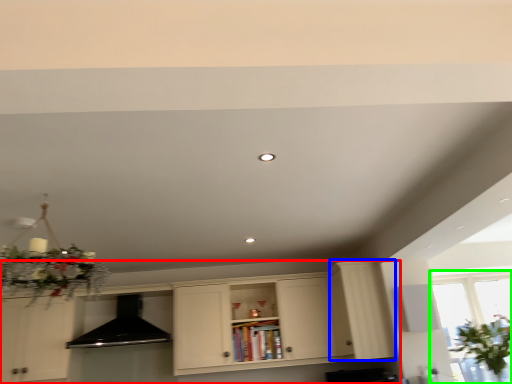
Question: Based on their relative distances, which object is nearer to cabinetry (highlighted by a red box)? Choose from cabinetry (highlighted by a blue box) and window (highlighted by a green box).

Choices:
 (A) cabinetry
 (B) window

Answer: (A)